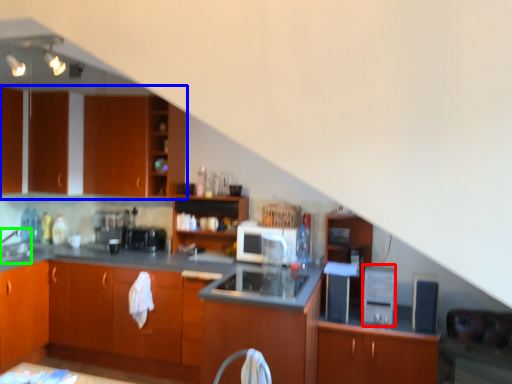
Question: Based on their relative distances, which object is nearer to appliance (highlighted by a red box)? Choose from cabinetry (highlighted by a blue box) and sink (highlighted by a green box).

Choices:
 (A) cabinetry
 (B) sink

Answer: (A)